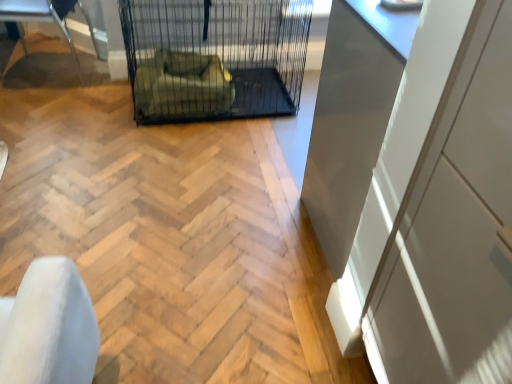
Question: Looking at their shapes, would you say green fabric armchair at center is wider or thinner than black wire mesh cage at center?

Choices:
 (A) wide
 (B) thin

Answer: (B)

Question: Choose the correct answer: Is green fabric armchair at center inside black wire mesh cage at center or outside it?

Choices:
 (A) outside
 (B) inside

Answer: (B)

Question: Which is farther from the black wire mesh cage at center?

Choices:
 (A) green fabric armchair at center
 (B) white glossy cabinet at right
 (C) metallic silver chair at left

Answer: (B)

Question: Which of these objects is positioned farthest from the metallic silver chair at left?

Choices:
 (A) black wire mesh cage at center
 (B) green fabric armchair at center
 (C) white glossy cabinet at right

Answer: (C)